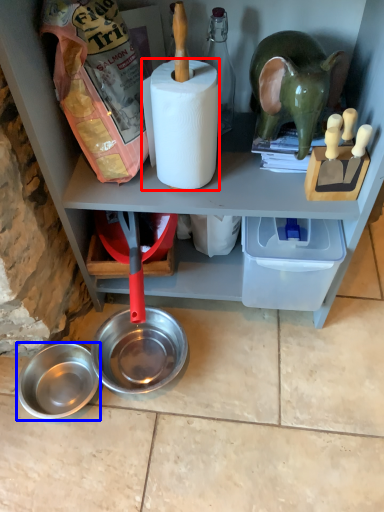
Question: Among these objects, which one is nearest to the camera, paper towel (highlighted by a red box) or bowl (highlighted by a blue box)?

Choices:
 (A) paper towel
 (B) bowl

Answer: (A)